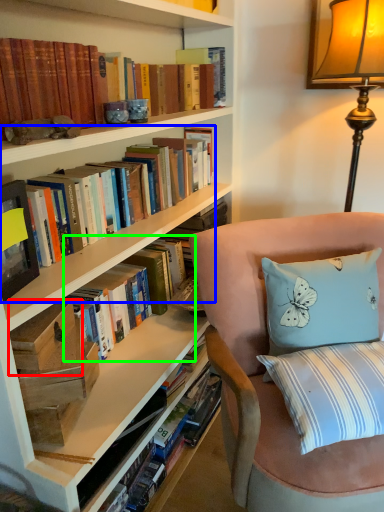
Question: Based on their relative distances, which object is farther from paperback book (highlighted by a red box)? Choose from book (highlighted by a blue box) and book (highlighted by a green box).

Choices:
 (A) book
 (B) book

Answer: (A)